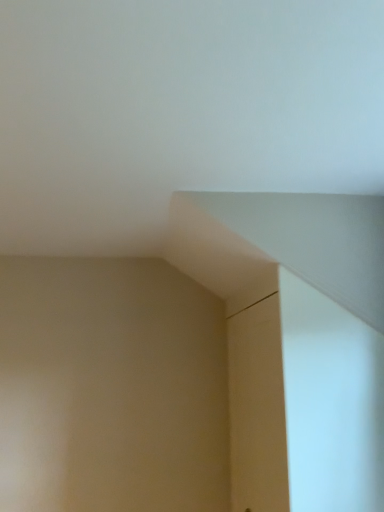
The height and width of the screenshot is (512, 384). Describe the element at coordinates (257, 408) in the screenshot. I see `matte wood door at center` at that location.

Where is `matte wood door at center`? The height and width of the screenshot is (512, 384). matte wood door at center is located at coordinates (257, 408).

I want to click on matte wood door at center, so click(257, 408).